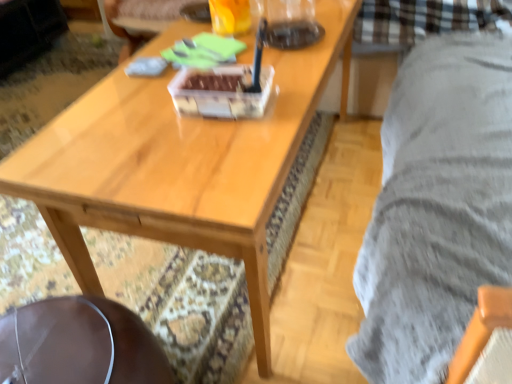
The width and height of the screenshot is (512, 384). Describe the element at coordinates (179, 165) in the screenshot. I see `wooden coffee table at center` at that location.

Find the location of `translucent glass beverage at upper center`. translucent glass beverage at upper center is located at coordinates (230, 16).

Image resolution: width=512 pixels, height=384 pixels. I want to click on brown leather swivel chair at lower left, so click(79, 344).

Where is `swivel chair below the translucent glass beverage at upper center (from the image's perspective)`? The width and height of the screenshot is (512, 384). swivel chair below the translucent glass beverage at upper center (from the image's perspective) is located at coordinates (79, 344).

How much distance is there between translucent glass beverage at upper center and brown leather swivel chair at lower left?

translucent glass beverage at upper center and brown leather swivel chair at lower left are 34.31 inches apart.

Is translucent glass beverage at upper center aimed at brown leather swivel chair at lower left?

No, translucent glass beverage at upper center is not facing towards brown leather swivel chair at lower left.

Considering the positions of objects translucent glass beverage at upper center and brown leather swivel chair at lower left in the image provided, who is more to the right, translucent glass beverage at upper center or brown leather swivel chair at lower left?

Positioned to the right is translucent glass beverage at upper center.

Is wooden coffee table at center far away from translucent glass beverage at upper center?

Actually, wooden coffee table at center and translucent glass beverage at upper center are a little close together.

In the scene shown: Considering their positions, is wooden coffee table at center located in front of or behind translucent glass beverage at upper center?

wooden coffee table at center is positioned closer to the viewer than translucent glass beverage at upper center.

From a real-world perspective, is wooden coffee table at center positioned above or below translucent glass beverage at upper center?

wooden coffee table at center is below translucent glass beverage at upper center.

Is brown leather swivel chair at lower left aimed at translucent glass beverage at upper center?

No, brown leather swivel chair at lower left is not facing towards translucent glass beverage at upper center.

From the image's perspective, is brown leather swivel chair at lower left beneath translucent glass beverage at upper center?

Correct, brown leather swivel chair at lower left appears lower than translucent glass beverage at upper center in the image.

Between brown leather swivel chair at lower left and translucent glass beverage at upper center, which one has more height?

brown leather swivel chair at lower left is taller.

From the image's perspective, would you say translucent glass beverage at upper center is positioned over wooden coffee table at center?

Correct, translucent glass beverage at upper center appears higher than wooden coffee table at center in the image.

What's the angular difference between translucent glass beverage at upper center and wooden coffee table at center's facing directions?

2.8 degrees.

Choose the correct answer: Is translucent glass beverage at upper center inside wooden coffee table at center or outside it?

The correct answer is: outside.

You are a GUI agent. You are given a task and a screenshot of the screen. Output one action in this format:
    pyautogui.click(x=<x>, y=<y>)
    Task: Click on the beverage behind the wooden coffee table at center
    The height and width of the screenshot is (384, 512).
    Given the screenshot: What is the action you would take?
    pyautogui.click(x=230, y=16)

Considering the sizes of brown leather swivel chair at lower left and wooden coffee table at center in the image, is brown leather swivel chair at lower left taller or shorter than wooden coffee table at center?

Considering their sizes, brown leather swivel chair at lower left has less height than wooden coffee table at center.

Which point is more forward, (94,383) or (140,185)?

The point (140,185) is closer to the camera.

Can you tell me how much brown leather swivel chair at lower left and wooden coffee table at center differ in facing direction?

1.21 degrees separate the facing orientations of brown leather swivel chair at lower left and wooden coffee table at center.

Is brown leather swivel chair at lower left next to wooden coffee table at center?

They are not placed beside each other.

From a real-world perspective, between wooden coffee table at center and brown leather swivel chair at lower left, who is vertically higher?

→ From a 3D spatial view, wooden coffee table at center is above.

Can you confirm if wooden coffee table at center is wider than brown leather swivel chair at lower left?

Indeed, wooden coffee table at center has a greater width compared to brown leather swivel chair at lower left.

From the image's perspective, who appears lower, wooden coffee table at center or brown leather swivel chair at lower left?

From the image's view, brown leather swivel chair at lower left is below.

This screenshot has width=512, height=384. I want to click on swivel chair below the translucent glass beverage at upper center (from the image's perspective), so click(x=79, y=344).

What are the coordinates of `coffee table on the right side of translucent glass beverage at upper center` in the screenshot? It's located at (179, 165).

Looking at the image, which one is located further to translucent glass beverage at upper center, brown leather swivel chair at lower left or wooden coffee table at center?

brown leather swivel chair at lower left lies further to translucent glass beverage at upper center than the other object.

When comparing their distances from translucent glass beverage at upper center, does wooden coffee table at center or brown leather swivel chair at lower left seem closer?

Based on the image, wooden coffee table at center appears to be nearer to translucent glass beverage at upper center.

Based on their spatial positions, is translucent glass beverage at upper center or wooden coffee table at center further from brown leather swivel chair at lower left?

A: translucent glass beverage at upper center is positioned further to the anchor brown leather swivel chair at lower left.

Based on their spatial positions, is wooden coffee table at center or translucent glass beverage at upper center further from brown leather swivel chair at lower left?

Among the two, translucent glass beverage at upper center is located further to brown leather swivel chair at lower left.

When comparing their distances from wooden coffee table at center, does brown leather swivel chair at lower left or translucent glass beverage at upper center seem closer?

The object closer to wooden coffee table at center is brown leather swivel chair at lower left.

Based on their spatial positions, is translucent glass beverage at upper center or brown leather swivel chair at lower left further from wooden coffee table at center?

The object further to wooden coffee table at center is translucent glass beverage at upper center.

Identify the location of coffee table between translucent glass beverage at upper center and brown leather swivel chair at lower left in the up-down direction. (179, 165).